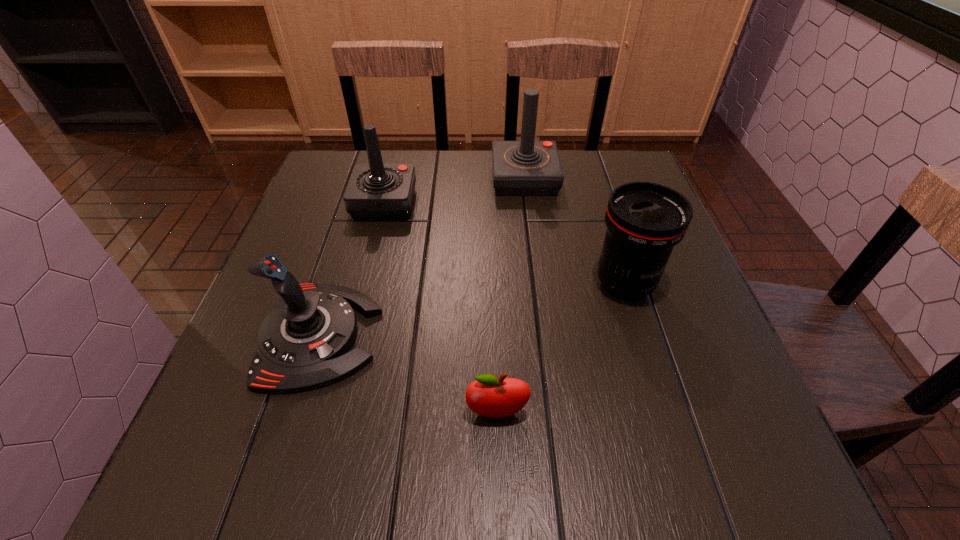
Locate an element on the screen. blank region between the rightmost object and the shortest object is located at coordinates (561, 348).

What are the coordinates of `free spot between the rightmost joystick and the rightmost object` in the screenshot? It's located at (574, 231).

Find the location of a particular element. This screenshot has width=960, height=540. free area in between the shortest object and the rightmost joystick is located at coordinates (511, 296).

Locate which object is the third closest to the rightmost object. Please provide its 2D coordinates. Your answer should be formatted as a tuple, i.e. [(x, y)], where the tuple contains the x and y coordinates of a point satisfying the conditions above.

[(374, 191)]

I want to click on the third closest object relative to the nearest object, so click(x=374, y=191).

Find the location of a particular element. The image size is (960, 540). joystick that stands as the second closest to the nearest object is located at coordinates (374, 191).

What are the coordinates of `the second closest joystick to the nearest joystick` in the screenshot? It's located at (520, 168).

The image size is (960, 540). In order to click on vacant space that satisfies the following two spatial constraints: 1. on the rectangular base of the rightmost joystick; 2. on the left side of the telephoto lens in this screenshot , I will do `click(538, 284)`.

You are a GUI agent. You are given a task and a screenshot of the screen. Output one action in this format:
    pyautogui.click(x=<x>, y=<y>)
    Task: Click on the blank space that satisfies the following two spatial constraints: 1. on the front side of the telephoto lens; 2. on the handle side of the nearest joystick
    Image resolution: width=960 pixels, height=540 pixels.
    Given the screenshot: What is the action you would take?
    pyautogui.click(x=641, y=336)

Identify the location of vacant position in the image that satisfies the following two spatial constraints: 1. on the rectangular base of the telephoto lens; 2. on the left side of the rightmost joystick. (538, 284).